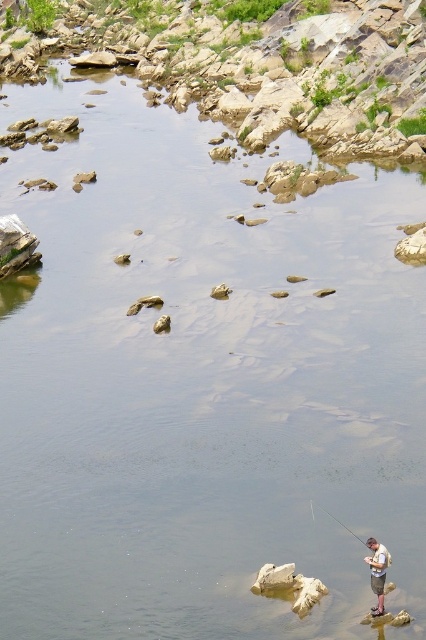
Question: From the image, what is the correct spatial relationship of khaki shorts at lower right in relation to smooth black rod at lower right?

Choices:
 (A) right
 (B) left

Answer: (A)

Question: Which point is farther to the camera?

Choices:
 (A) (371, 609)
 (B) (348, 528)

Answer: (B)

Question: Can you confirm if khaki shorts at lower right is positioned to the right of smooth black rod at lower right?

Choices:
 (A) yes
 (B) no

Answer: (A)

Question: Does khaki shorts at lower right appear on the right side of smooth black rod at lower right?

Choices:
 (A) yes
 (B) no

Answer: (A)

Question: Which of the following is the farthest from the observer?

Choices:
 (A) smooth black rod at lower right
 (B) khaki shorts at lower right

Answer: (A)

Question: Which point appears farthest from the camera in this image?

Choices:
 (A) (385, 561)
 (B) (359, 540)

Answer: (B)